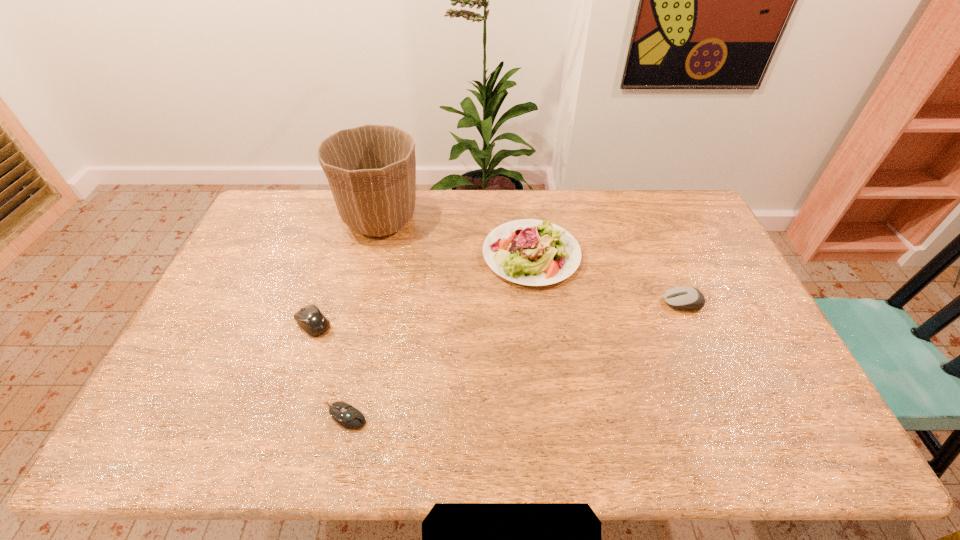
The width and height of the screenshot is (960, 540). I want to click on free space between the rightmost object and the leftmost computer mouse, so click(498, 313).

Select which object is the third closest to the second tallest object. Please provide its 2D coordinates. Your answer should be formatted as a tuple, i.e. [(x, y)], where the tuple contains the x and y coordinates of a point satisfying the conditions above.

[(310, 318)]

I want to click on object that stands as the second closest to the flowerpot, so click(310, 318).

The image size is (960, 540). Identify the location of computer mouse that stands as the closest to the tallest object. pos(310,318).

I want to click on computer mouse that is the second closest one to the salad plate, so click(310, 318).

At what (x,y) coordinates should I click in order to perform the action: click on vacant area that satisfies the following two spatial constraints: 1. on the back side of the tallest object; 2. on the left side of the leftmost computer mouse. Please return your answer as a coordinate pair (x, y). This screenshot has width=960, height=540. Looking at the image, I should click on (348, 218).

This screenshot has width=960, height=540. Identify the location of vacant space that satisfies the following two spatial constraints: 1. on the wheel side of the rightmost object; 2. on the front side of the leftmost computer mouse. (691, 323).

Where is `free space that satisfies the following two spatial constraints: 1. on the wheel side of the rightmost object; 2. on the front side of the leftmost computer mouse`? This screenshot has width=960, height=540. free space that satisfies the following two spatial constraints: 1. on the wheel side of the rightmost object; 2. on the front side of the leftmost computer mouse is located at coordinates (691, 323).

Locate an element on the screen. This screenshot has width=960, height=540. free location that satisfies the following two spatial constraints: 1. on the wheel side of the rightmost object; 2. on the front side of the leftmost computer mouse is located at coordinates (691, 323).

The height and width of the screenshot is (540, 960). I want to click on free space that satisfies the following two spatial constraints: 1. on the front side of the nearest computer mouse; 2. on the left side of the tallest object, so click(x=331, y=416).